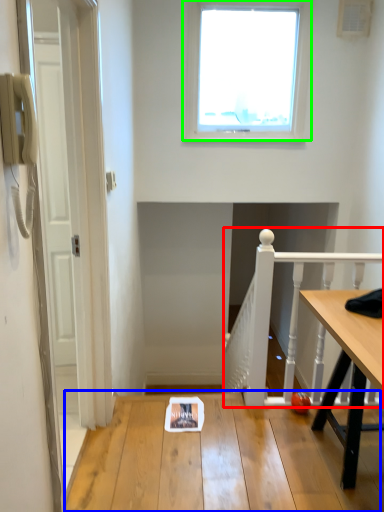
Question: Estimate the real-world distances between objects in this image. Which object is closer to rail (highlighted by a red box), table (highlighted by a blue box) or window (highlighted by a green box)?

Choices:
 (A) table
 (B) window

Answer: (A)